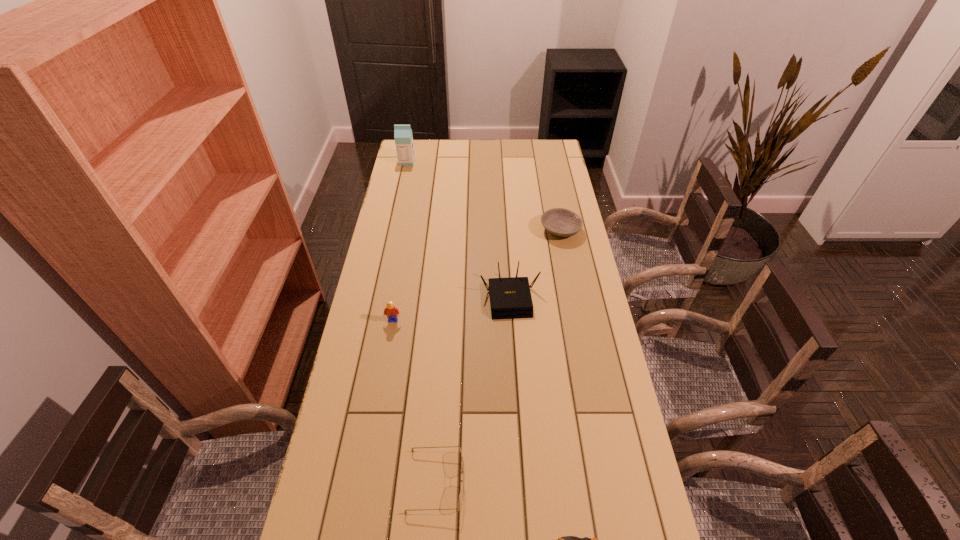
Where is `vacant space located 0.200m on the back of the second farthest object`? vacant space located 0.200m on the back of the second farthest object is located at coordinates point(552,189).

Where is `free space located 0.210m on the front-facing side of the spectacles`? This screenshot has width=960, height=540. free space located 0.210m on the front-facing side of the spectacles is located at coordinates (549, 481).

What are the coordinates of `object that is at the far edge` in the screenshot? It's located at (403, 137).

You are a GUI agent. You are given a task and a screenshot of the screen. Output one action in this format:
    pyautogui.click(x=<x>, y=<y>)
    Task: Click on the milk carton that is positioned at the left edge
    The height and width of the screenshot is (540, 960).
    Given the screenshot: What is the action you would take?
    pyautogui.click(x=403, y=137)

The height and width of the screenshot is (540, 960). Identify the location of Lego located in the left edge section of the desktop. (390, 311).

Identify the location of object located at the right edge. The image size is (960, 540). pos(562,222).

Identify the location of object at the far left corner. The image size is (960, 540). (403, 137).

Where is `free space at the far edge`? Image resolution: width=960 pixels, height=540 pixels. free space at the far edge is located at coordinates (503, 158).

At what (x,y) coordinates should I click in order to perform the action: click on free space at the left edge of the desktop. Please return your answer as a coordinate pair (x, y). The height and width of the screenshot is (540, 960). Looking at the image, I should click on (348, 449).

This screenshot has width=960, height=540. In the image, there is a desktop. In order to click on free space at the right edge in this screenshot , I will do `click(552, 241)`.